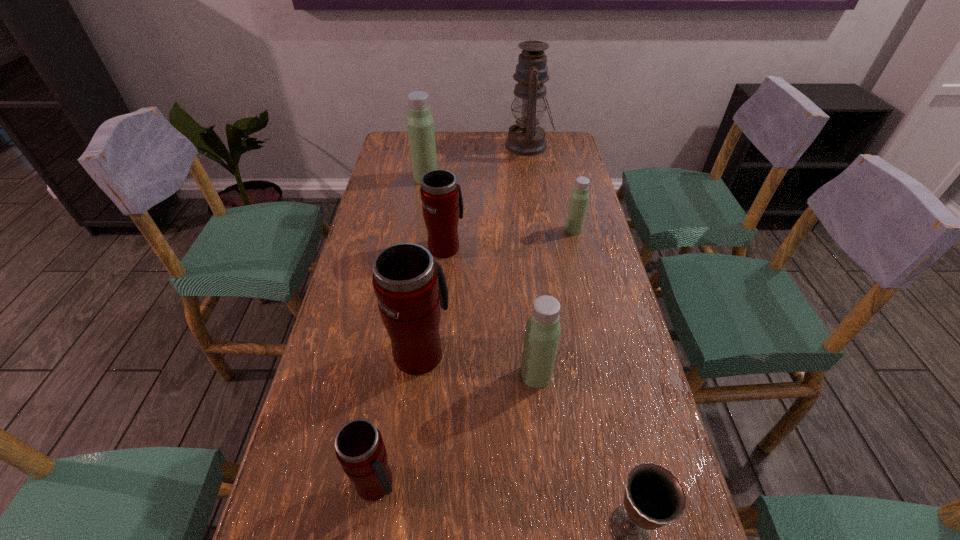
Locate an element on the screen. vacant space situated 0.060m on the right of the second light thermos bottle from left to right is located at coordinates (578, 375).

Where is `blank space located on the side with the handle of the smallest red thermos bottle`? The height and width of the screenshot is (540, 960). blank space located on the side with the handle of the smallest red thermos bottle is located at coordinates (443, 484).

Identify the location of vacant region located on the back of the second nearest light thermos bottle. This screenshot has height=540, width=960. (560, 170).

At what (x,y) coordinates should I click in order to perform the action: click on object present at the far edge. Please return your answer as a coordinate pair (x, y). The image size is (960, 540). Looking at the image, I should click on (526, 138).

Where is `oil lamp present at the right edge`? The image size is (960, 540). oil lamp present at the right edge is located at coordinates (526, 138).

Identify the location of thermos bottle that is at the right edge. The width and height of the screenshot is (960, 540). (579, 197).

The width and height of the screenshot is (960, 540). What are the coordinates of `object situated at the far right corner` in the screenshot? It's located at (526, 138).

In the image, there is a desktop. Where is `vacant space at the far edge`? vacant space at the far edge is located at coordinates (451, 141).

The height and width of the screenshot is (540, 960). Identify the location of free space at the left edge of the desktop. (281, 481).

In the image, there is a desktop. At what (x,y) coordinates should I click in order to perform the action: click on vacant space at the right edge. Please return your answer as a coordinate pair (x, y). The width and height of the screenshot is (960, 540). Looking at the image, I should click on (543, 187).